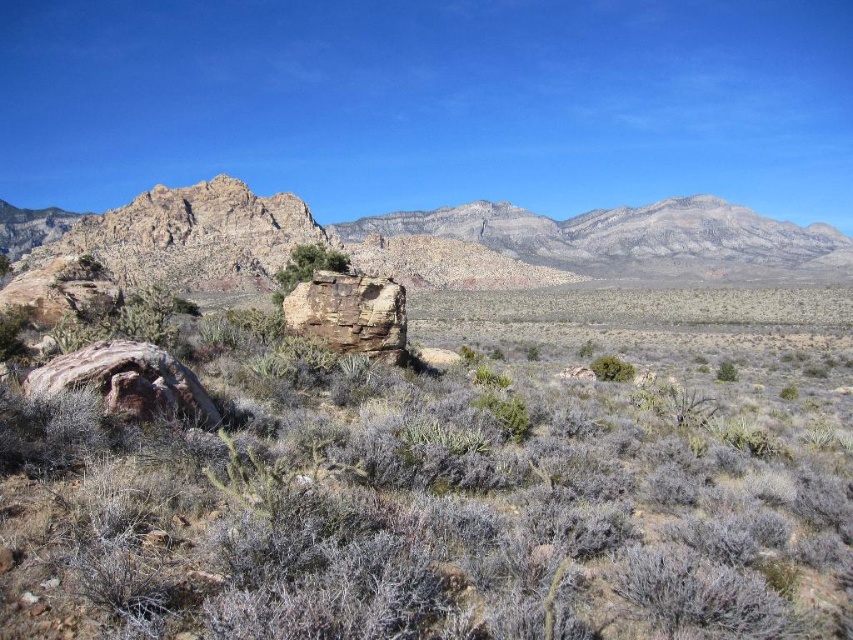
Is the position of rusty rock at center more distant than that of rugged rock formation at upper center?

No, rusty rock at center is closer to the viewer.

Which is in front, point (804, 589) or point (689, 214)?

Point (804, 589)

I want to click on rusty rock at center, so click(438, 499).

Does rusty rock at center appear on the right side of green leafy bush at center?

→ Indeed, rusty rock at center is positioned on the right side of green leafy bush at center.

Does rusty rock at center appear on the left side of green leafy bush at center?

No, rusty rock at center is not to the left of green leafy bush at center.

Which is in front, point (300, 474) or point (630, 376)?

Point (300, 474) is more forward.

Image resolution: width=853 pixels, height=640 pixels. I want to click on rusty rock at center, so click(438, 499).

Is point (190, 196) positioned behind point (346, 257)?

That is True.

Between point (508, 212) and point (300, 269), which one is positioned in front?

Positioned in front is point (300, 269).

I want to click on rugged rock formation at upper center, so pos(426,241).